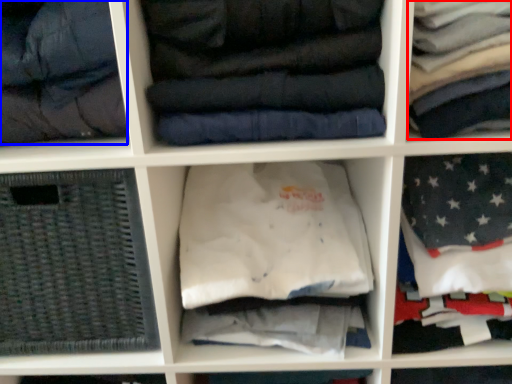
Question: Which point is further to the camera, clothing (highlighted by a red box) or garment (highlighted by a blue box)?

Choices:
 (A) clothing
 (B) garment

Answer: (B)